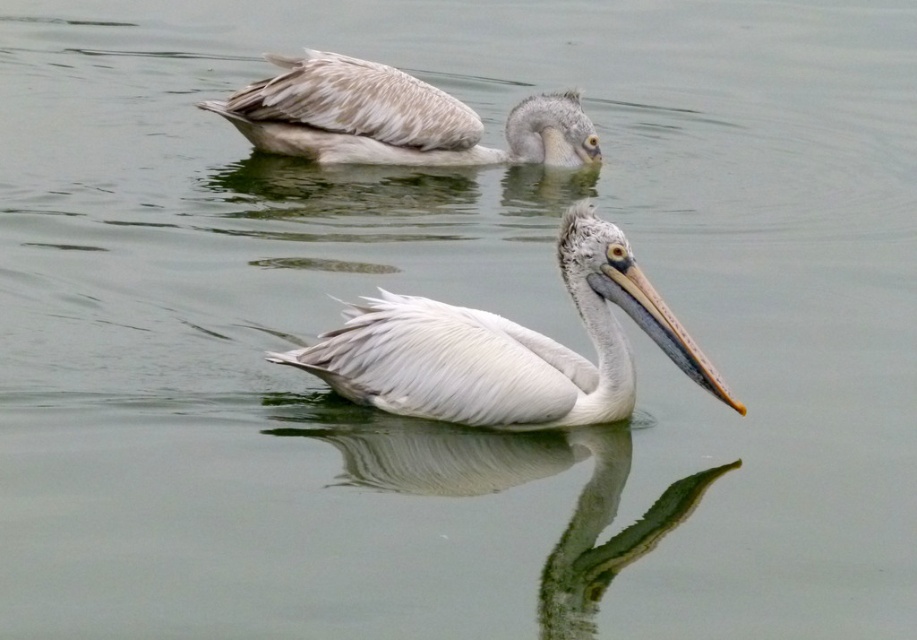
Question: Can you confirm if white feathered pelican at center is positioned below white glossy water at lower center?

Choices:
 (A) yes
 (B) no

Answer: (B)

Question: Which point is farther to the camera?

Choices:
 (A) (573, 522)
 (B) (575, 365)
 (C) (335, 54)

Answer: (C)

Question: In this image, where is white feathered pelican at center located relative to grayish-white feathers at upper center?

Choices:
 (A) above
 (B) below

Answer: (B)

Question: Which of the following is the farthest from the observer?

Choices:
 (A) white feathered pelican at center
 (B) white glossy water at lower center

Answer: (A)

Question: Which point is farther to the camera?

Choices:
 (A) (372, 464)
 (B) (522, 365)
 (C) (369, 163)

Answer: (C)

Question: Considering the relative positions of white feathered pelican at center and white glossy water at lower center in the image provided, where is white feathered pelican at center located with respect to white glossy water at lower center?

Choices:
 (A) below
 (B) above

Answer: (B)